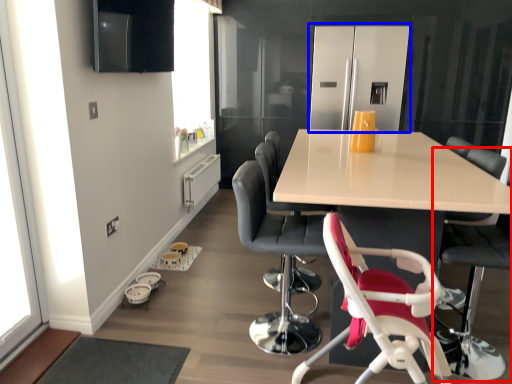
Question: Which object appears farthest to the camera in this image, chair (highlighted by a red box) or appliance (highlighted by a blue box)?

Choices:
 (A) chair
 (B) appliance

Answer: (B)